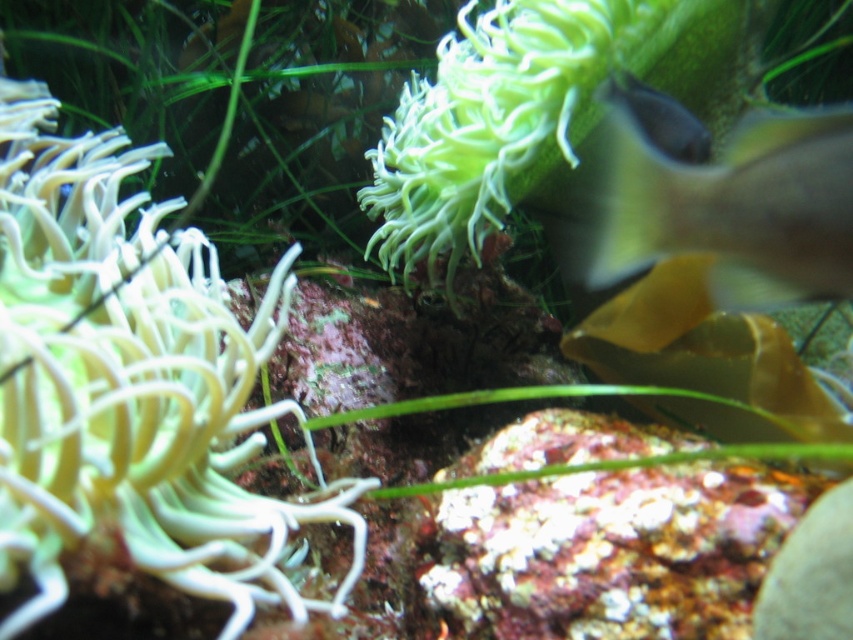
Question: Among these objects, which one is farthest from the camera?

Choices:
 (A) translucent yellow fish at right
 (B) white soft coral at left

Answer: (A)

Question: Which object is farther from the camera taking this photo?

Choices:
 (A) white soft coral at left
 (B) translucent yellow fish at right

Answer: (B)

Question: Is white soft coral at left wider than translucent yellow fish at right?

Choices:
 (A) yes
 (B) no

Answer: (A)

Question: Is the position of white soft coral at left more distant than that of translucent yellow fish at right?

Choices:
 (A) yes
 (B) no

Answer: (B)

Question: Can you confirm if white soft coral at left is bigger than translucent yellow fish at right?

Choices:
 (A) yes
 (B) no

Answer: (A)